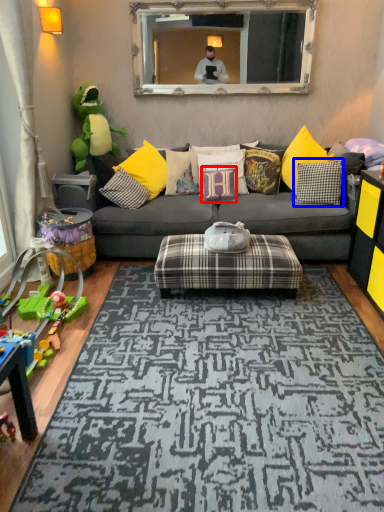
Question: Which object is further to the camera taking this photo, pillow (highlighted by a red box) or pillow (highlighted by a blue box)?

Choices:
 (A) pillow
 (B) pillow

Answer: (A)